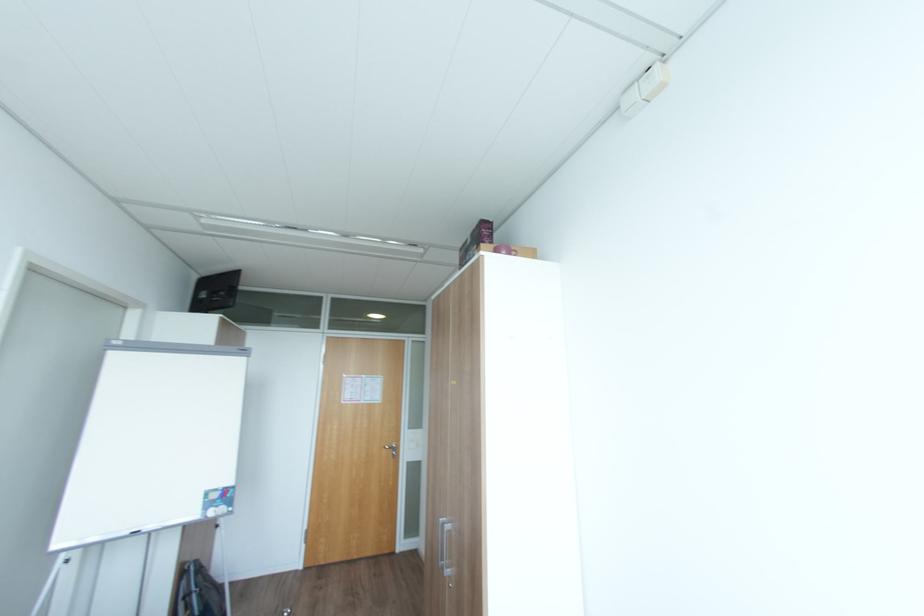
The width and height of the screenshot is (924, 616). What are the coordinates of `purple mug` in the screenshot? It's located at (504, 249).